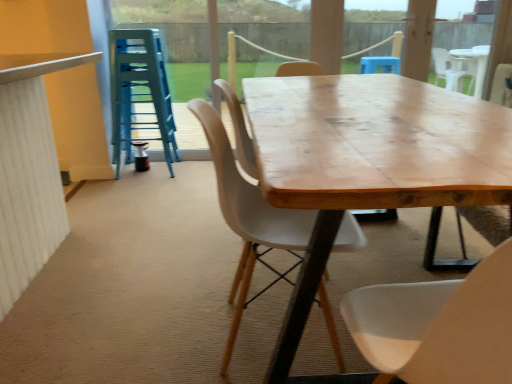
Question: From the image's perspective, is wooden table at center above transparent glass door at upper center?

Choices:
 (A) no
 (B) yes

Answer: (A)

Question: Considering the relative positions of wooden table at center and transparent glass door at upper center in the image provided, is wooden table at center in front of transparent glass door at upper center?

Choices:
 (A) yes
 (B) no

Answer: (A)

Question: Is wooden table at center aimed at transparent glass door at upper center?

Choices:
 (A) yes
 (B) no

Answer: (B)

Question: Does wooden table at center come behind transparent glass door at upper center?

Choices:
 (A) no
 (B) yes

Answer: (A)

Question: Can you confirm if wooden table at center is positioned to the left of transparent glass door at upper center?

Choices:
 (A) no
 (B) yes

Answer: (A)

Question: Looking at the image, does blue plastic stool at left seem bigger or smaller compared to wooden table at center?

Choices:
 (A) big
 (B) small

Answer: (B)

Question: Considering the positions of blue plastic stool at left and wooden table at center in the image, is blue plastic stool at left wider or thinner than wooden table at center?

Choices:
 (A) thin
 (B) wide

Answer: (A)

Question: From their relative heights in the image, would you say blue plastic stool at left is taller or shorter than wooden table at center?

Choices:
 (A) short
 (B) tall

Answer: (B)

Question: From the image's perspective, is blue plastic stool at left positioned above or below wooden table at center?

Choices:
 (A) below
 (B) above

Answer: (B)

Question: Is transparent glass door at upper center situated inside blue plastic stool at left or outside?

Choices:
 (A) outside
 (B) inside

Answer: (A)

Question: From their relative heights in the image, would you say transparent glass door at upper center is taller or shorter than blue plastic stool at left?

Choices:
 (A) short
 (B) tall

Answer: (B)

Question: Considering the positions of transparent glass door at upper center and blue plastic stool at left in the image, is transparent glass door at upper center bigger or smaller than blue plastic stool at left?

Choices:
 (A) small
 (B) big

Answer: (B)

Question: From a real-world perspective, is transparent glass door at upper center physically located above or below blue plastic stool at left?

Choices:
 (A) above
 (B) below

Answer: (A)

Question: Is transparent glass door at upper center taller or shorter than wooden chair at center?

Choices:
 (A) short
 (B) tall

Answer: (B)

Question: In terms of width, does transparent glass door at upper center look wider or thinner when compared to wooden chair at center?

Choices:
 (A) wide
 (B) thin

Answer: (B)